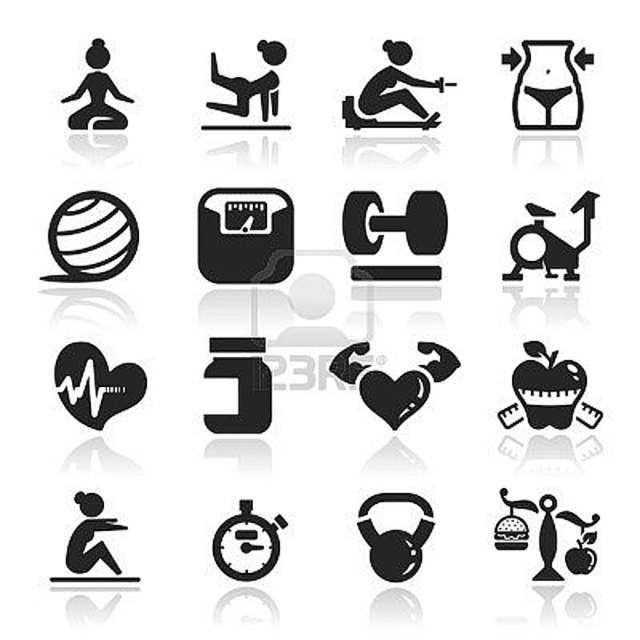
You are an interior designer arranging these silhouettes on a wall. You want to place a new decorative item between the transparent plastic waist at upper right and the black matte figure at center. Based on their current positions, where should you place the new item?

The transparent plastic waist at upper right is positioned under the black matte figure at center, so placing the new item between them would require positioning it below the black matte figure at center and above the transparent plastic waist at upper right.

You are organizing a fitness event and need to place the black rubber stopwatch at center and the black matte exercise bike at upper right on a shelf. If the shelf has a maximum width capacity of 1.2 meters, can both items fit side by side?

The black rubber stopwatch at center has a smaller width than the black matte exercise bike at upper right, but the combined width of both items is not provided. Therefore, it is uncertain if they can fit on the shelf together.